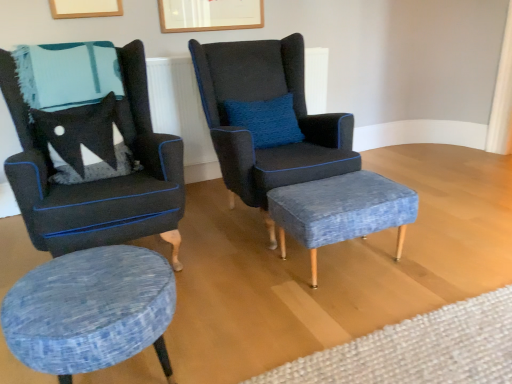
In order to click on free area in between blue fabric stool at center, which appears as the 2th stool when viewed from the front, and textured blue fabric stool at lower left, the second stool viewed from the right in this screenshot , I will do `click(262, 315)`.